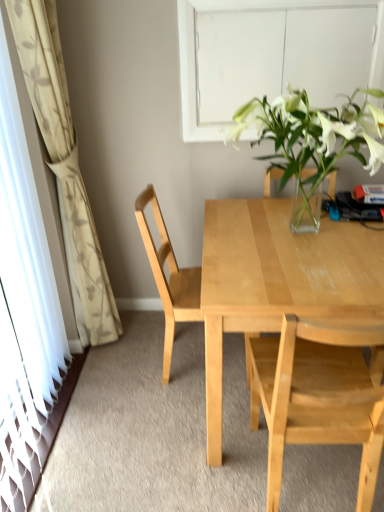
This screenshot has width=384, height=512. In order to click on vacant area that is situated to the right of white floral-patterned curtain at left in this screenshot , I will do `click(149, 347)`.